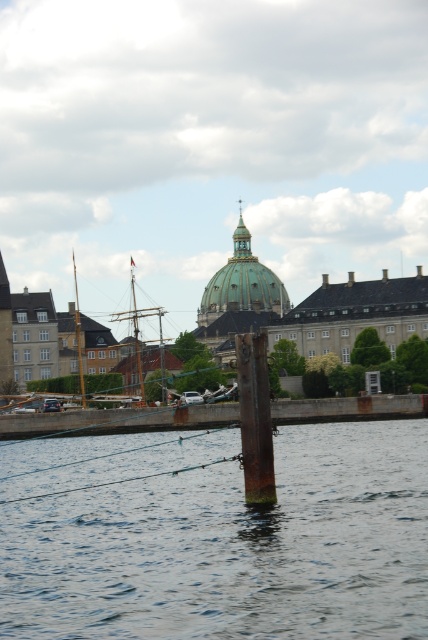
You are navigating a small boat and need to drop an anchor. The rusty metal post at lower center is in your path. Based on its coordinates, will it interfere with your anchor drop at position point 0.839, 0.505?

The rusty metal post at lower center is exactly at position point (216, 536), so dropping the anchor there will interfere with the post.

Looking at this image, you are a marine engineer assessing the structural integrity of the waterfront setup. Given that the rusty metal post at lower center and the rusty metal pole at center are both critical support structures, which one has a larger cross sectional area?

The rusty metal post at lower center has a larger cross sectional area than the rusty metal pole at center because its width surpasses the pole.

You are an architect designing a new waterfront structure. You need to place a large statue that requires a base with a diameter of 3 meters. Given the scene, can the rusty metal dock at center support the statue? Consider the size of the dock relative to the green marble dome at center as a reference.

The rusty metal dock at center has a larger size compared to the green marble dome at center. Since the dock is larger, it likely has sufficient space to accommodate the statue with a 3m diameter base.